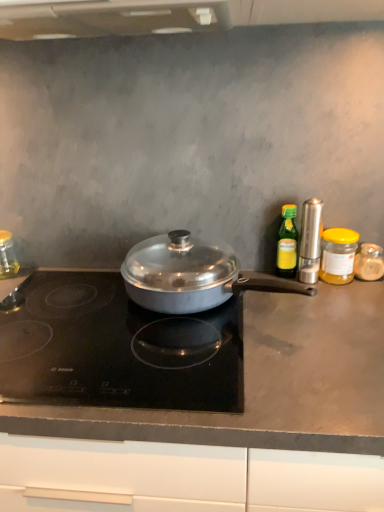
Find the location of a particular element. The width and height of the screenshot is (384, 512). free space above black glass cooktop at center (from a real-world perspective) is located at coordinates (89, 323).